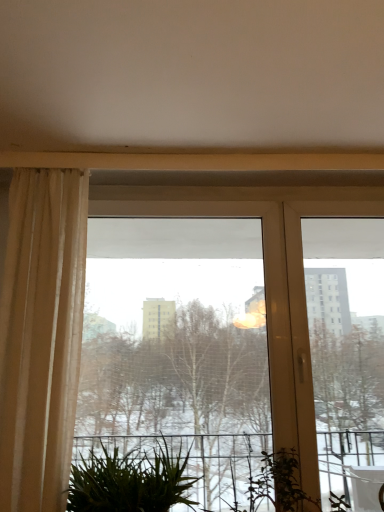
Question: Does green leafy plant at lower center have a greater width compared to transparent glass window at center?

Choices:
 (A) no
 (B) yes

Answer: (B)

Question: Can you confirm if green leafy plant at lower center is bigger than transparent glass window at center?

Choices:
 (A) no
 (B) yes

Answer: (A)

Question: Is green leafy plant at lower center at the right side of transparent glass window at center?

Choices:
 (A) no
 (B) yes

Answer: (A)

Question: Is transparent glass window at center at the back of green leafy plant at lower center?

Choices:
 (A) yes
 (B) no

Answer: (A)

Question: Does green leafy plant at lower center have a greater height compared to transparent glass window at center?

Choices:
 (A) no
 (B) yes

Answer: (A)

Question: From the image's perspective, is transparent glass window at center positioned above or below green leafy plant at lower center?

Choices:
 (A) below
 (B) above

Answer: (B)

Question: Is point [x=200, y=161] closer or farther from the camera than point [x=105, y=498]?

Choices:
 (A) closer
 (B) farther

Answer: (B)

Question: Looking at the image, does transparent glass window at center seem bigger or smaller compared to green leafy plant at lower center?

Choices:
 (A) small
 (B) big

Answer: (B)

Question: Is transparent glass window at center in front of or behind green leafy plant at lower center in the image?

Choices:
 (A) behind
 (B) front

Answer: (A)

Question: Does point (69, 396) appear closer or farther from the camera than point (370, 185)?

Choices:
 (A) closer
 (B) farther

Answer: (A)

Question: Is beige sheer curtain at left to the left or to the right of transparent glass window at center in the image?

Choices:
 (A) right
 (B) left

Answer: (B)

Question: From the image's perspective, is beige sheer curtain at left positioned above or below transparent glass window at center?

Choices:
 (A) above
 (B) below

Answer: (A)

Question: Would you say beige sheer curtain at left is inside or outside transparent glass window at center?

Choices:
 (A) inside
 (B) outside

Answer: (B)

Question: Looking at their shapes, would you say green leafy plant at lower center is wider or thinner than beige sheer curtain at left?

Choices:
 (A) wide
 (B) thin

Answer: (A)

Question: Is point (96, 497) closer or farther from the camera than point (21, 418)?

Choices:
 (A) closer
 (B) farther

Answer: (B)